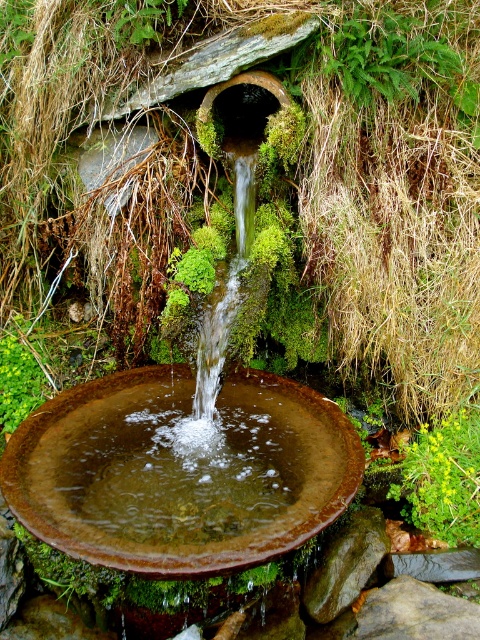
You are designing a garden layout and need to place a small statue that is 1 meter wide. You have two options for placement near the water feature. The first option is next to the green leafy plant at lower right, and the second is next to the brown rough stone at center. Which location would allow the statue to fit better without overcrowding the area?

The green leafy plant at lower right has a smaller width than the brown rough stone at center, so placing the statue next to the green leafy plant at lower right would provide more space and prevent overcrowding.

You are a gardener who wants to place a new decorative statue that is 24 inches wide between the rusty metal bird bath at center and the green leafy plant at lower right. Can the statue fit in the space between them without overlapping either object?

The rusty metal bird bath at center is 26.07 inches away from the green leafy plant at lower right. Since the statue is 24 inches wide, it can fit in the space between them as the distance between the two objects is greater than the statue width.